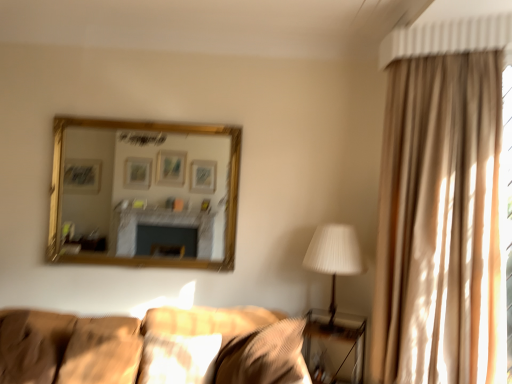
Question: Considering the relative sizes of suede-like brown pillow at lower left, which is the 1th pillow from left to right, and matte beige pillow at center, which is counted as the third pillow, starting from the left, in the image provided, is suede-like brown pillow at lower left, which is the 1th pillow from left to right, thinner than matte beige pillow at center, which is counted as the third pillow, starting from the left,?

Choices:
 (A) no
 (B) yes

Answer: (A)

Question: Considering the relative sizes of suede-like brown pillow at lower left, arranged as the fourth pillow when viewed from the right, and matte beige pillow at center, placed as the second pillow when sorted from right to left, in the image provided, is suede-like brown pillow at lower left, arranged as the fourth pillow when viewed from the right, shorter than matte beige pillow at center, placed as the second pillow when sorted from right to left,?

Choices:
 (A) yes
 (B) no

Answer: (B)

Question: Does suede-like brown pillow at lower left, arranged as the fourth pillow when viewed from the right, have a greater height compared to matte beige pillow at center, placed as the second pillow when sorted from right to left?

Choices:
 (A) no
 (B) yes

Answer: (B)

Question: Is suede-like brown pillow at lower left, which is the 1th pillow from left to right, located outside matte beige pillow at center, which is counted as the third pillow, starting from the left?

Choices:
 (A) yes
 (B) no

Answer: (A)

Question: Is suede-like brown pillow at lower left, arranged as the fourth pillow when viewed from the right, positioned with its back to matte beige pillow at center, placed as the second pillow when sorted from right to left?

Choices:
 (A) yes
 (B) no

Answer: (B)

Question: In the image, is soft beige pillow at lower left, which ranks as the 3th pillow in right-to-left order, on the left side or the right side of beige fabric curtain at right?

Choices:
 (A) right
 (B) left

Answer: (B)

Question: Considering the positions of soft beige pillow at lower left, which ranks as the second pillow in left-to-right order, and beige fabric curtain at right in the image, is soft beige pillow at lower left, which ranks as the second pillow in left-to-right order, wider or thinner than beige fabric curtain at right?

Choices:
 (A) wide
 (B) thin

Answer: (A)

Question: Choose the correct answer: Is soft beige pillow at lower left, which ranks as the 3th pillow in right-to-left order, inside beige fabric curtain at right or outside it?

Choices:
 (A) outside
 (B) inside

Answer: (A)

Question: Is soft beige pillow at lower left, which ranks as the 3th pillow in right-to-left order, taller or shorter than beige fabric curtain at right?

Choices:
 (A) short
 (B) tall

Answer: (A)

Question: Based on their positions, is white pleated fabric at right located to the left or right of soft beige pillow at lower left, which ranks as the second pillow in left-to-right order?

Choices:
 (A) left
 (B) right

Answer: (B)

Question: From the image's perspective, is white pleated fabric at right above or below soft beige pillow at lower left, which ranks as the second pillow in left-to-right order?

Choices:
 (A) below
 (B) above

Answer: (B)

Question: Considering the positions of point (327, 266) and point (80, 375), is point (327, 266) closer or farther from the camera than point (80, 375)?

Choices:
 (A) farther
 (B) closer

Answer: (A)

Question: Considering their positions, is white pleated fabric at right located in front of or behind soft beige pillow at lower left, which ranks as the second pillow in left-to-right order?

Choices:
 (A) front
 (B) behind

Answer: (B)

Question: Is textured beige pillow at lower center, acting as the fourth pillow starting from the left, taller or shorter than gold-framed mirror at upper center?

Choices:
 (A) short
 (B) tall

Answer: (A)

Question: Considering the positions of textured beige pillow at lower center, acting as the fourth pillow starting from the left, and gold-framed mirror at upper center in the image, is textured beige pillow at lower center, acting as the fourth pillow starting from the left, bigger or smaller than gold-framed mirror at upper center?

Choices:
 (A) big
 (B) small

Answer: (A)